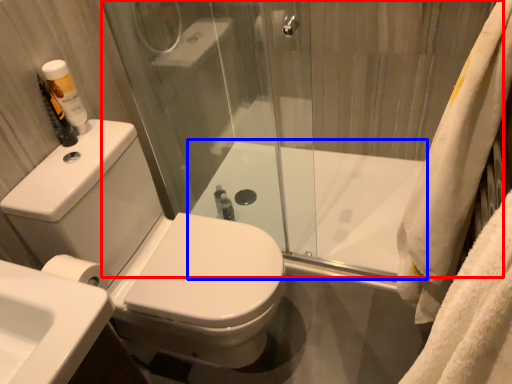
Question: Which of the following is the farthest to the observer, shower door (highlighted by a red box) or bath (highlighted by a blue box)?

Choices:
 (A) shower door
 (B) bath

Answer: (B)